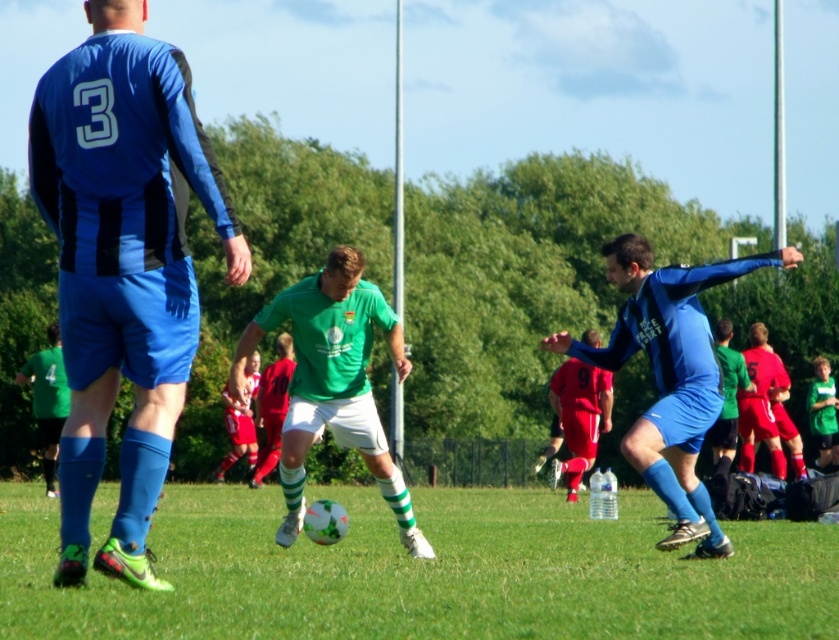
You are a soccer coach observing the game. You notice the blue jersey with the number 3 on the left and the green matte jersey at center. How far apart are these two players?

The blue jersey with the number 3 on the left and the green matte jersey at center are 11.54 meters apart.

You are a soccer referee observing the game. You notice two players, the blue matte jersey at center and the green jersey at center. Which player is positioned to the left side of the other?

The blue matte jersey at center is to the left of the green jersey at center, so the blue matte jersey at center is positioned to the left of the green jersey at center.